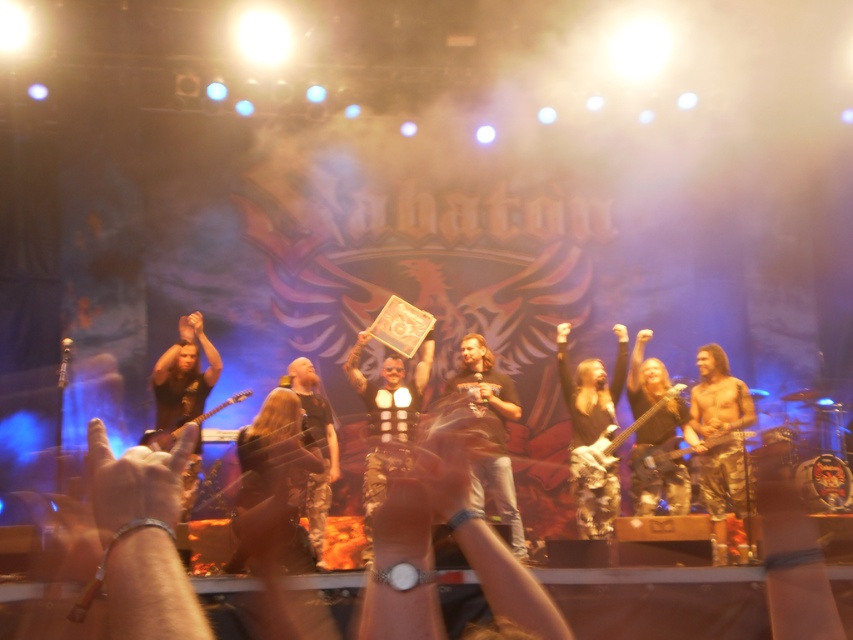
You are a photographer positioned at the camera. You want to take a closeup shot of the brown leather jacket at center. Given that your camera can focus on objects within 5 meters, will you be able to capture the jacket clearly?

The distance between the brown leather jacket at center and the camera is 5.89 meters, which is beyond the camera focus range of 5 meters. Therefore, you cannot capture the jacket clearly.

You are a stagehand at the concert and need to place two markers at the specified points. The first marker is at point (515, 518) and the second at point (601, 472). Which marker will be closer to the audience sitting in front of the stage?

The marker at point (601, 472) will be closer to the audience because point (515, 518) is behind point (601, 472).